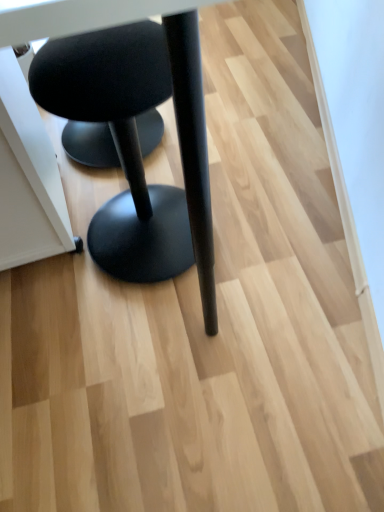
The image size is (384, 512). What do you see at coordinates (120, 142) in the screenshot?
I see `matte black stool at left` at bounding box center [120, 142].

Where is `matte black stool at left`? matte black stool at left is located at coordinates (120, 142).

This screenshot has width=384, height=512. What are the coordinates of `matte black stool at left` in the screenshot? It's located at (120, 142).